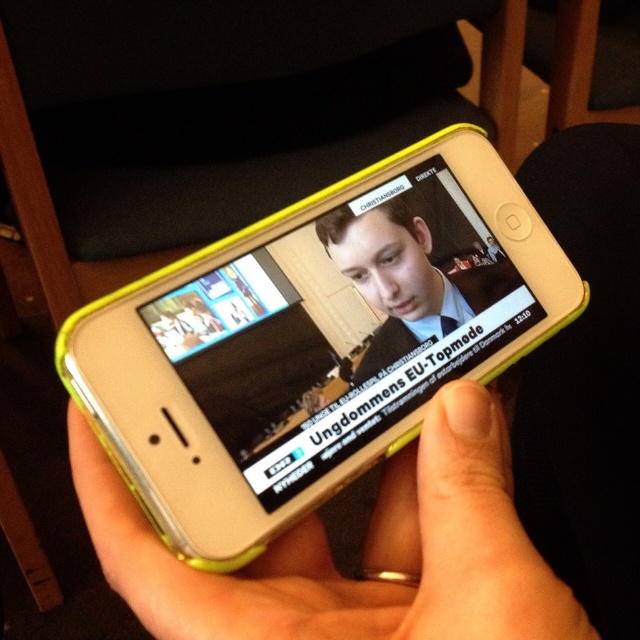
Does yellow plastic smartphone at center appear on the right side of matte plastic hand at center?

Indeed, yellow plastic smartphone at center is positioned on the right side of matte plastic hand at center.

Consider the image. Between yellow plastic smartphone at center and matte plastic hand at center, which one appears on the left side from the viewer's perspective?

Positioned to the left is matte plastic hand at center.

Is point (125, 308) more distant than point (269, 595)?

Yes.

This screenshot has width=640, height=640. Identify the location of yellow plastic smartphone at center. (310, 342).